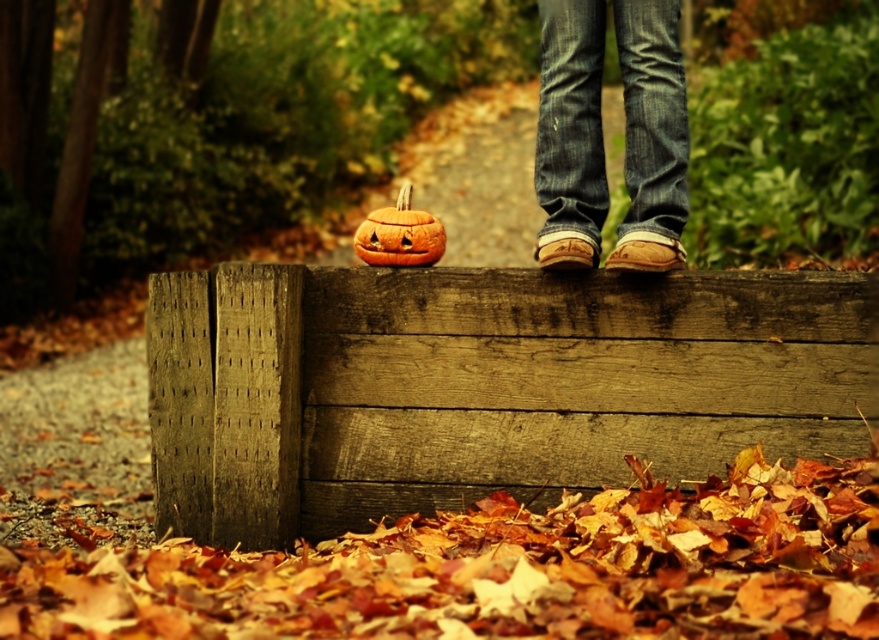
In the scene shown: You are standing in the autumn scene and want to sit on the weathered wood at center. Based on its coordinates, can you estimate how far it is from the bottom edge of the image?

The weathered wood at center is located at coordinates point (480,385). The y coordinate 0.547 indicates it is approximately 54.7 percent from the bottom edge of the image.

You are trying to place a small decorative item on the weathered wood at center. The orange matte pumpkin at center is already occupying part of the space. Can the new item fit alongside the pumpkin without overlapping?

The weathered wood at center is bigger than orange matte pumpkin at center, so there is enough space to place the new item alongside the pumpkin without overlapping.

You are standing in the autumn scene and notice the denim jeans at center. Based on their position, can you determine if they are closer to the front or the back of the image?

The denim jeans at center is located at point 0.209 on the x and 0.650 on the y, which places them closer to the back of the image since lower y coordinates are closer to the bottom and higher y coordinates are closer to the top. However, in image coordinates, typically the origin is at the top left, so a higher y coordinate would mean it is lower in the image, hence closer to the bottom. Therefore, the jeans are closer to the back if the bench is in the foreground and the person is standing on it, but the